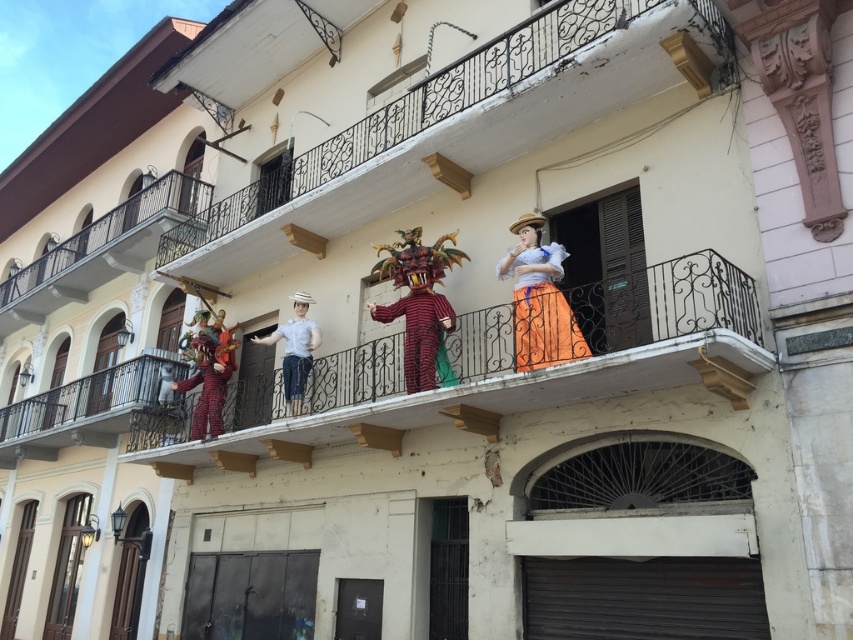
Which is more to the right, white wrought iron balcony at center or white wrought iron balcony at upper left?

white wrought iron balcony at center

From the picture: Does white wrought iron balcony at center come behind white wrought iron balcony at upper left?

No, it is not.

Between point (177, 237) and point (125, 262), which one is positioned behind?

The point (125, 262) is behind.

This screenshot has width=853, height=640. Find the location of `white wrought iron balcony at center`. white wrought iron balcony at center is located at coordinates (451, 125).

Does white wrought iron balcony at center lie behind striped fabric dragon at center?

No, it is in front of striped fabric dragon at center.

Is point (415, 182) farther from viewer compared to point (434, 349)?

Yes, point (415, 182) is farther from viewer.

Is point (189, 241) in front of point (450, 305)?

No, (189, 241) is behind (450, 305).

Image resolution: width=853 pixels, height=640 pixels. I want to click on white wrought iron balcony at center, so click(x=451, y=125).

Does white painted wood balcony at center appear on the right side of white wrought iron balcony at upper left?

Yes, white painted wood balcony at center is to the right of white wrought iron balcony at upper left.

Is white painted wood balcony at center positioned behind white wrought iron balcony at upper left?

No.

You are a GUI agent. You are given a task and a screenshot of the screen. Output one action in this format:
    pyautogui.click(x=<x>, y=<y>)
    Task: Click on the white painted wood balcony at center
    This screenshot has width=853, height=640.
    Given the screenshot: What is the action you would take?
    614,332